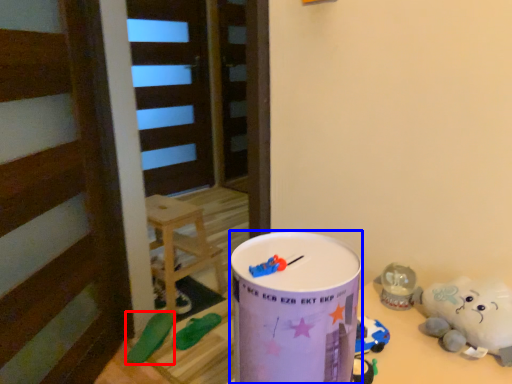
Question: Among these objects, which one is farthest to the camera, toy (highlighted by a red box) or milk can (highlighted by a blue box)?

Choices:
 (A) toy
 (B) milk can

Answer: (A)